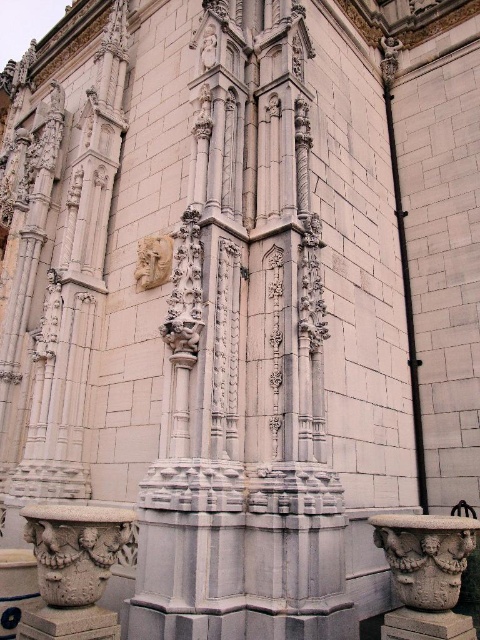
Question: Which point is closer to the camera?

Choices:
 (A) white stone sculpture at center
 (B) white stone column at lower left
 (C) carved stone vase at lower right

Answer: (B)

Question: Is white stone column at lower left to the right of white stone mask at center from the viewer's perspective?

Choices:
 (A) yes
 (B) no

Answer: (B)

Question: Is white stone column at lower left below white stone mask at center?

Choices:
 (A) no
 (B) yes

Answer: (B)

Question: Which point appears closest to the camera in this image?

Choices:
 (A) (168, 280)
 (B) (420, 573)
 (C) (181, 333)

Answer: (B)

Question: Does white stone column at lower left have a larger size compared to white stone sculpture at center?

Choices:
 (A) no
 (B) yes

Answer: (B)

Question: Which object appears closest to the camera in this image?

Choices:
 (A) white stone sculpture at center
 (B) white stone mask at center
 (C) white stone column at lower left
 (D) carved stone vase at lower right

Answer: (C)